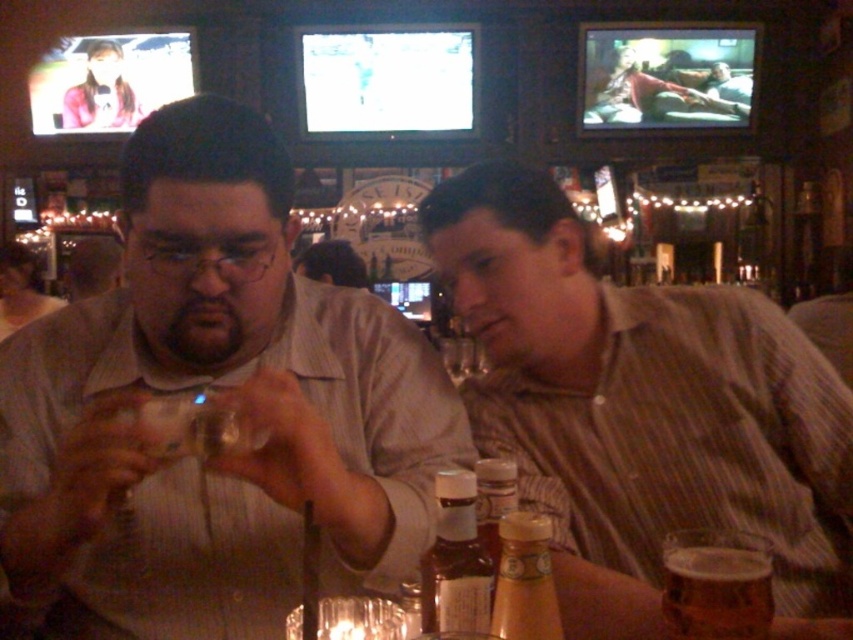
Looking at this image, does matte brown shirt at center lie in front of translucent amber glass bottle at center?

No, matte brown shirt at center is behind translucent amber glass bottle at center.

Does matte brown shirt at center have a greater width compared to translucent amber glass bottle at center?

Yes, matte brown shirt at center is wider than translucent amber glass bottle at center.

Identify the location of matte brown shirt at center. The height and width of the screenshot is (640, 853). (218, 387).

Is point (614, 596) closer to viewer compared to point (538, 528)?

No, (614, 596) is further to viewer.

Between brown striped shirt at center and translucent amber glass bottle at center, which one appears on the right side from the viewer's perspective?

Positioned to the right is brown striped shirt at center.

Locate an element on the screen. This screenshot has height=640, width=853. brown striped shirt at center is located at coordinates (642, 410).

Does translucent glass mug at lower right have a larger size compared to translucent glass bottle at center?

No, translucent glass mug at lower right is not bigger than translucent glass bottle at center.

Is point (747, 548) less distant than point (445, 502)?

No, (747, 548) is further to viewer.

The image size is (853, 640). Describe the element at coordinates (717, 588) in the screenshot. I see `translucent glass mug at lower right` at that location.

Image resolution: width=853 pixels, height=640 pixels. In order to click on translucent glass mug at lower right in this screenshot , I will do `click(717, 588)`.